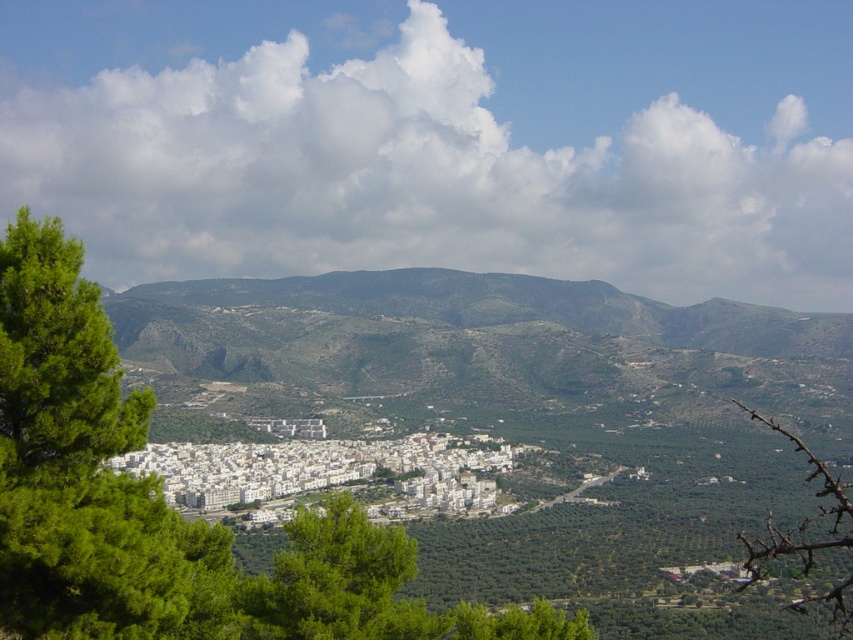
Is green leafy tree at center-left positioned before green spiny branch at lower right?

No, green leafy tree at center-left is further to the viewer.

Based on the photo, is green leafy tree at center-left thinner than green spiny branch at lower right?

Yes.

Which is behind, point (91, 522) or point (827, 532)?

Point (827, 532)

You are a GUI agent. You are given a task and a screenshot of the screen. Output one action in this format:
    pyautogui.click(x=<x>, y=<y>)
    Task: Click on the green leafy tree at center-left
    
    Given the screenshot: What is the action you would take?
    pyautogui.click(x=163, y=504)